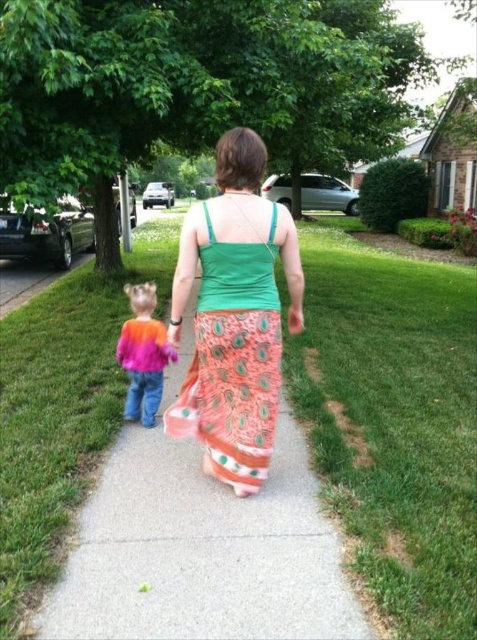
Is orange peacock-patterned dress at center to the right of multicolored knit sweater at center from the viewer's perspective?

Yes, orange peacock-patterned dress at center is to the right of multicolored knit sweater at center.

Measure the distance between orange peacock-patterned dress at center and multicolored knit sweater at center.

They are 19.46 inches apart.

The height and width of the screenshot is (640, 477). Describe the element at coordinates (234, 358) in the screenshot. I see `orange peacock-patterned dress at center` at that location.

Find the location of `orange peacock-patterned dress at center`. orange peacock-patterned dress at center is located at coordinates (234, 358).